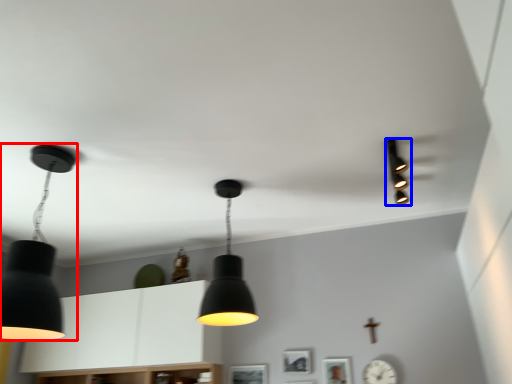
Question: Which object appears closest to the camera in this image, lamp (highlighted by a red box) or lamp (highlighted by a blue box)?

Choices:
 (A) lamp
 (B) lamp

Answer: (A)